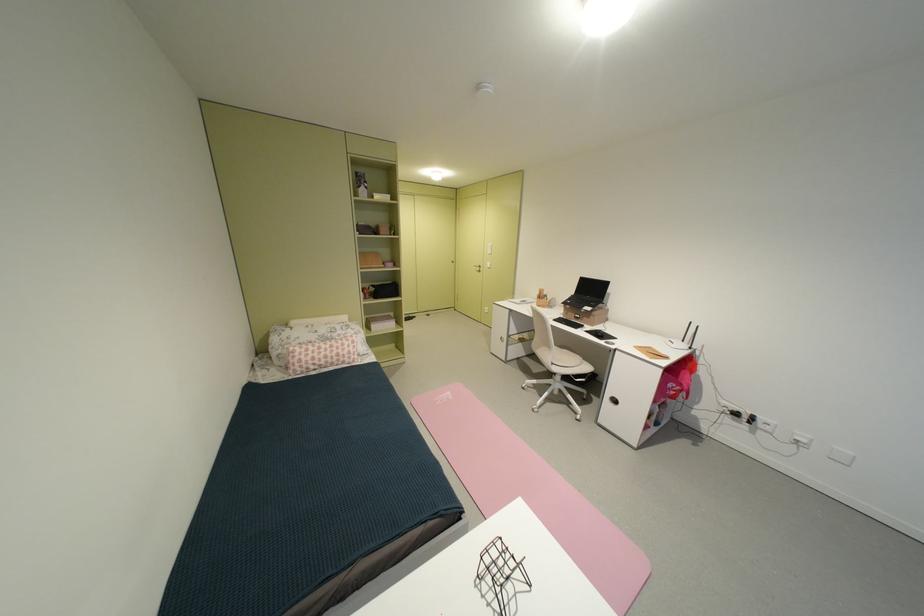
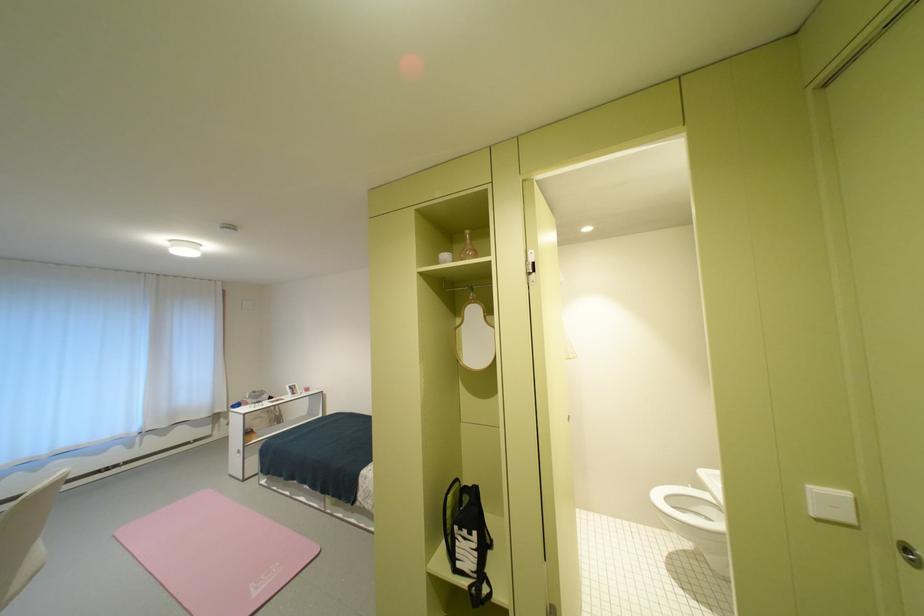
The point at (446, 405) is marked in the first image. Where is the corresponding point in the second image?

(286, 565)